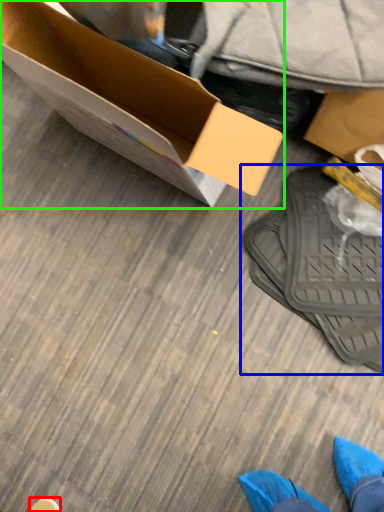
Question: Considering the real-world distances, which object is farthest from shoe (highlighted by a red box)? footwear (highlighted by a blue box) or box (highlighted by a green box)?

Choices:
 (A) footwear
 (B) box

Answer: (B)